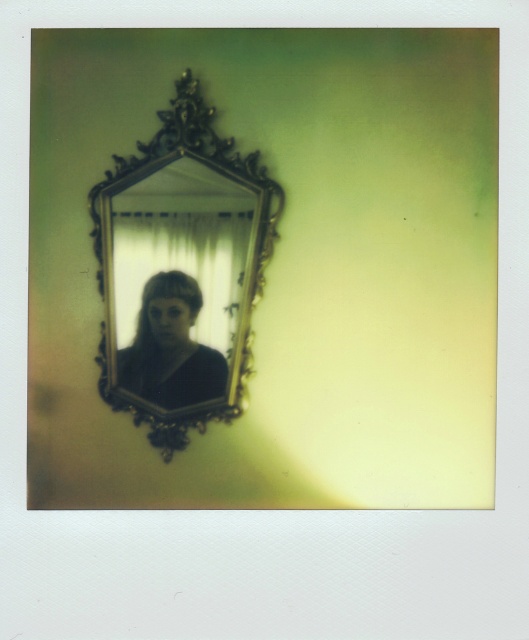
Question: Among these objects, which one is nearest to the camera?

Choices:
 (A) matte black hair at center
 (B) gold ornate mirror at center

Answer: (B)

Question: Is gold ornate mirror at center behind matte black hair at center?

Choices:
 (A) yes
 (B) no

Answer: (B)

Question: Is gold ornate mirror at center thinner than matte black hair at center?

Choices:
 (A) yes
 (B) no

Answer: (B)

Question: Which of the following is the farthest from the observer?

Choices:
 (A) matte black hair at center
 (B) gold ornate mirror at center

Answer: (A)

Question: Which of the following is the closest to the observer?

Choices:
 (A) (157, 296)
 (B) (162, 360)

Answer: (A)

Question: Is gold ornate mirror at center bigger than matte black hair at center?

Choices:
 (A) yes
 (B) no

Answer: (A)